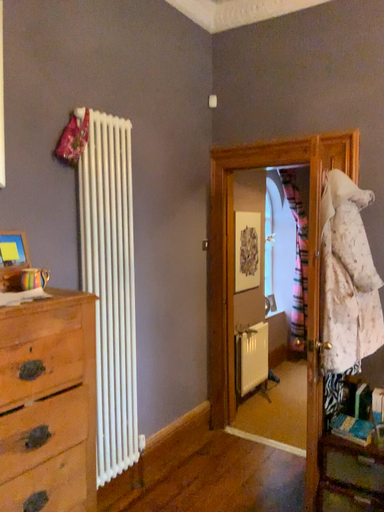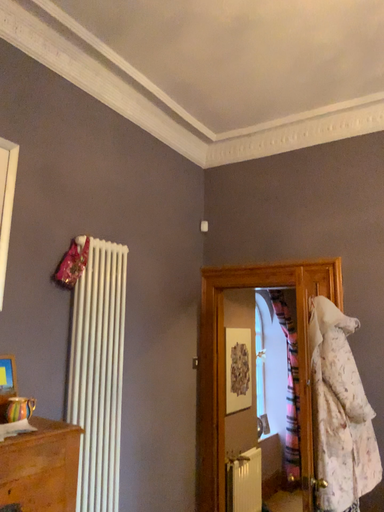
Question: How did the camera likely rotate when shooting the video?

Choices:
 (A) rotated upward
 (B) rotated downward

Answer: (A)